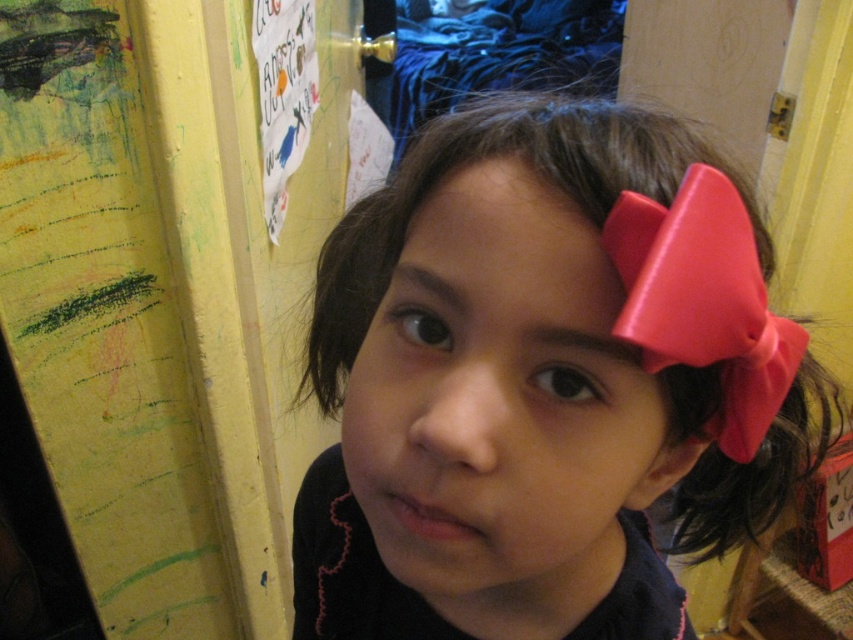
You are a photographer taking a picture of the child and the yellow door. You notice two points marked on the image. Which point is closer to you, point (x=527, y=573) or point (x=727, y=241)?

Point (x=527, y=573) is closer to you because it is further to the viewer than point (x=727, y=241).

You are a photographer taking a portrait of the child. The pink satin bow at right and the smooth skin at center are both important elements. Which object is located below the other?

The pink satin bow at right is positioned under the smooth skin at center, so it is located below the smooth skin at center.